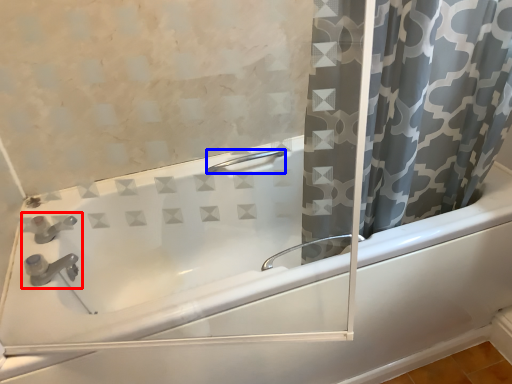
Question: Which object is closer to the camera taking this photo, sink (highlighted by a red box) or shower (highlighted by a blue box)?

Choices:
 (A) sink
 (B) shower

Answer: (A)